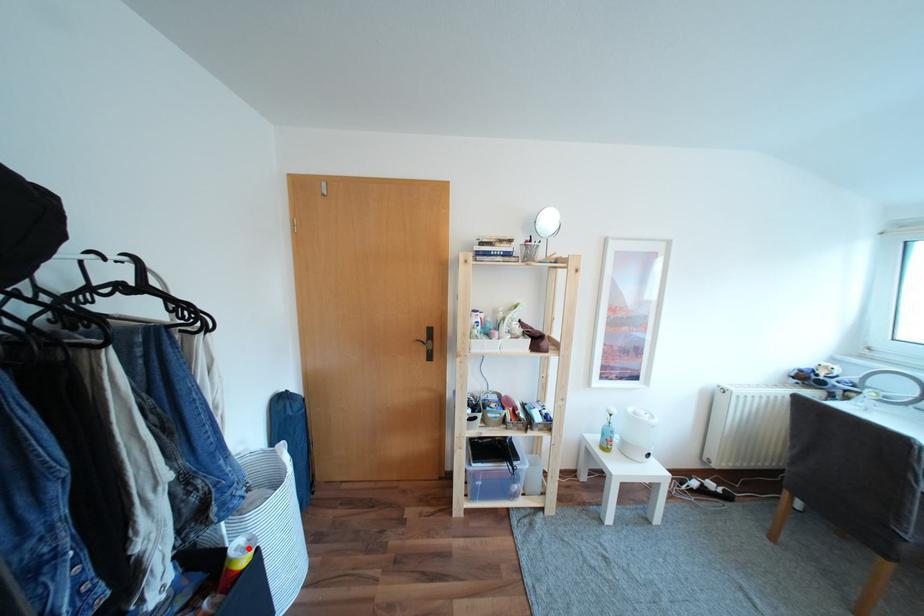
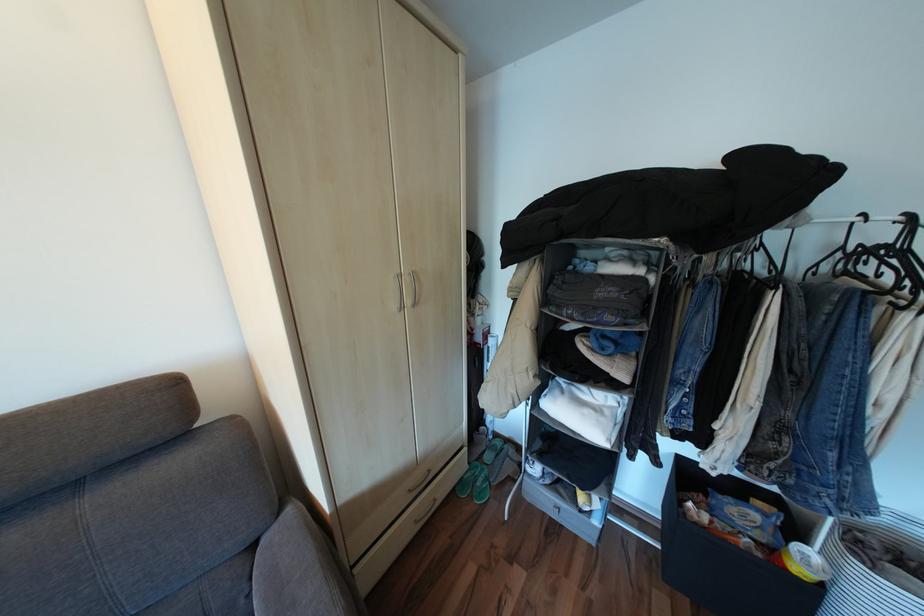
The point at the highlighted location is marked in the first image. Where is the corresponding point in the second image?

(815, 554)